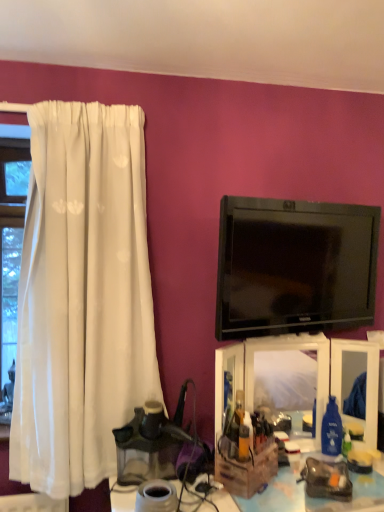
Question: Are wooden crate at lower right and black glossy tv at upper right beside each other?

Choices:
 (A) yes
 (B) no

Answer: (B)

Question: From the image's perspective, would you say wooden crate at lower right is shown under black glossy tv at upper right?

Choices:
 (A) no
 (B) yes

Answer: (B)

Question: Could black glossy tv at upper right be considered to be inside wooden crate at lower right?

Choices:
 (A) yes
 (B) no

Answer: (B)

Question: From a real-world perspective, is wooden crate at lower right on top of black glossy tv at upper right?

Choices:
 (A) no
 (B) yes

Answer: (A)

Question: From a real-world perspective, does wooden crate at lower right sit lower than black glossy tv at upper right?

Choices:
 (A) yes
 (B) no

Answer: (A)

Question: Does wooden crate at lower right have a smaller size compared to black glossy tv at upper right?

Choices:
 (A) yes
 (B) no

Answer: (B)

Question: Considering the relative positions of translucent plastic makeup organizer at center and wooden crate at lower right in the image provided, is translucent plastic makeup organizer at center behind wooden crate at lower right?

Choices:
 (A) no
 (B) yes

Answer: (B)

Question: Is wooden crate at lower right at the back of translucent plastic makeup organizer at center?

Choices:
 (A) no
 (B) yes

Answer: (A)

Question: Is translucent plastic makeup organizer at center thinner than wooden crate at lower right?

Choices:
 (A) yes
 (B) no

Answer: (A)

Question: Is translucent plastic makeup organizer at center outside of wooden crate at lower right?

Choices:
 (A) no
 (B) yes

Answer: (B)

Question: From a real-world perspective, does translucent plastic makeup organizer at center stand above wooden crate at lower right?

Choices:
 (A) yes
 (B) no

Answer: (A)

Question: Is translucent plastic makeup organizer at center facing towards wooden crate at lower right?

Choices:
 (A) no
 (B) yes

Answer: (A)

Question: Is the position of translucent plastic makeup organizer at center more distant than that of black glossy tv at upper right?

Choices:
 (A) yes
 (B) no

Answer: (A)